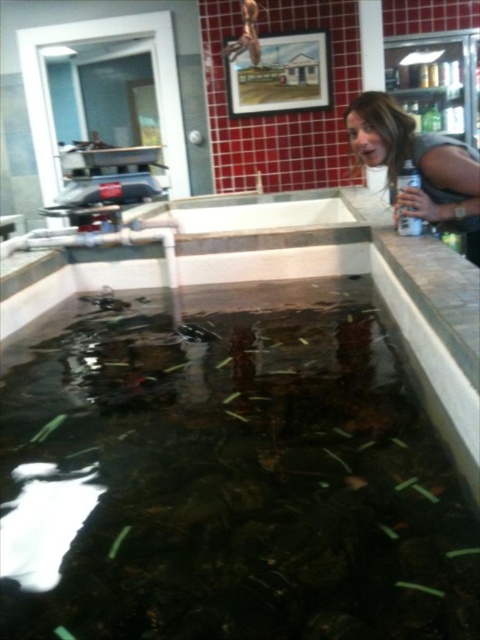
Which is below, translucent glass tank at center or blonde hair at upper right?

translucent glass tank at center is lower down.

Can you confirm if translucent glass tank at center is wider than blonde hair at upper right?

Yes.

Between point (216, 381) and point (445, 179), which one is positioned in front?

Point (216, 381) is in front.

Where is `translucent glass tank at center`? translucent glass tank at center is located at coordinates (228, 477).